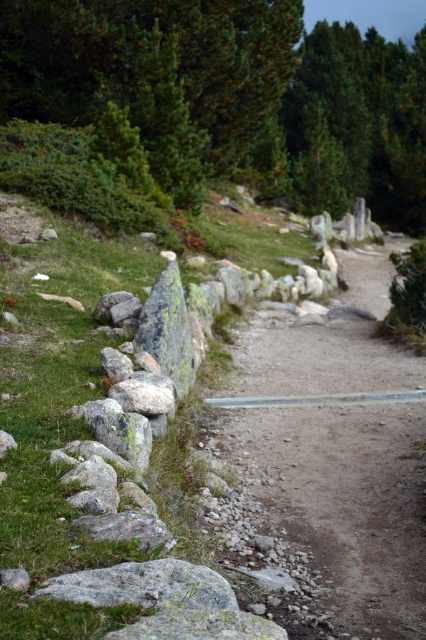
You are standing at the point marked by the coordinates (241, 90) in the forest scene. Looking around, you see a green leafy tree at upper center. Which direction should you walk to reach the dirt path bordered by the stone wall?

The point marked by the coordinates (241, 90) indicates the green leafy tree at upper center. To reach the dirt path bordered by the stone wall, you should walk downward from the green leafy tree at upper center toward the lower part of the image where the path is located.

You are a hiker who wants to take a photo of the green leafy tree at upper center. You have a camera with a 50mm lens. Where should you stand relative to the path to capture the tree in your shot?

The green leafy tree at upper center is located at coordinates 0.142 on the x axis and 0.566 on the y axis. To capture it in your shot, you should position yourself along the path near those coordinates, ensuring the tree is centered in your viewfinder.